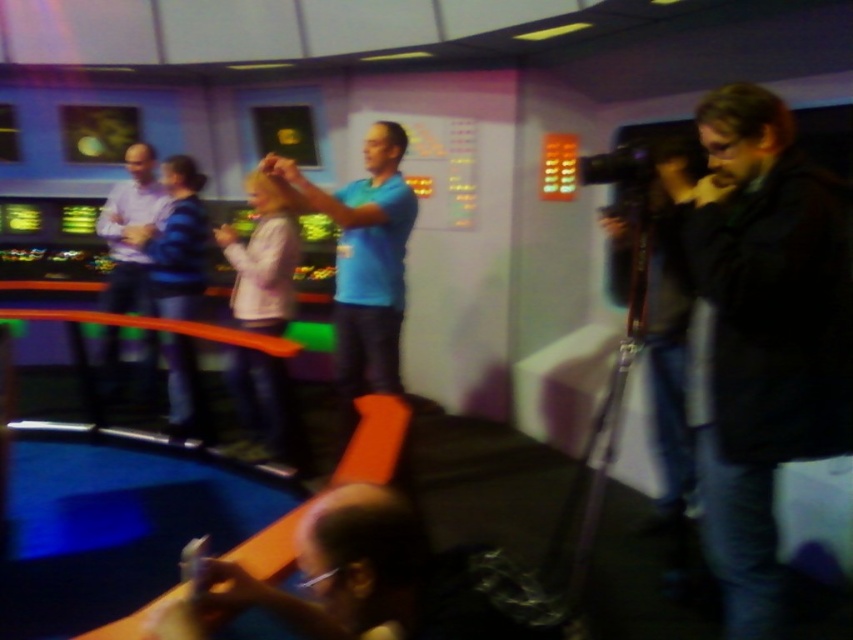
You are a costume designer preparing for a sci fi movie scene. You have two props to place in the control room set. The dark brown leather jacket at right and the blue striped sweater at center. The director wants to ensure that the larger prop is placed where it can be seen from the main camera angle. Which prop should you choose?

The dark brown leather jacket at right is bigger than the blue striped sweater at center, so you should choose the dark brown leather jacket at right to be placed where it can be seen from the main camera angle since it is larger and more noticeable.

You are a maintenance worker in the control room who needs to reach the light purple shirt at left from the blue striped sweater at center. Given that your tool box is 14 inches wide, can you pass through the space between them?

The distance between the blue striped sweater at center and the light purple shirt at left is 15.19 inches. Since your toolbox is 14 inches wide, you can pass through the space between them as the distance is slightly larger than the toolbox width.

You are standing in the control room and need to determine which of the two points, point (715, 278) or point (157, 262), is nearer to you. Based on the scene, which point is closer?

Point (715, 278) is closer to the viewer than point (157, 262).